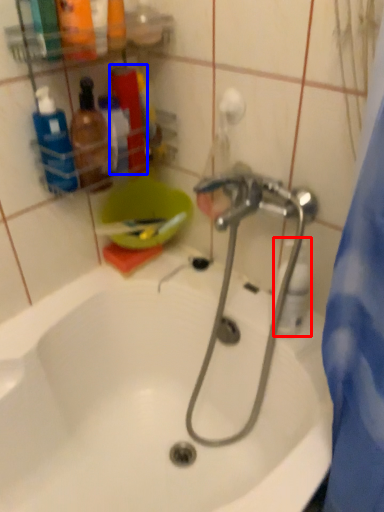
Question: Which object appears closest to the camera in this image, cleaning product (highlighted by a red box) or toiletry (highlighted by a blue box)?

Choices:
 (A) cleaning product
 (B) toiletry

Answer: (A)